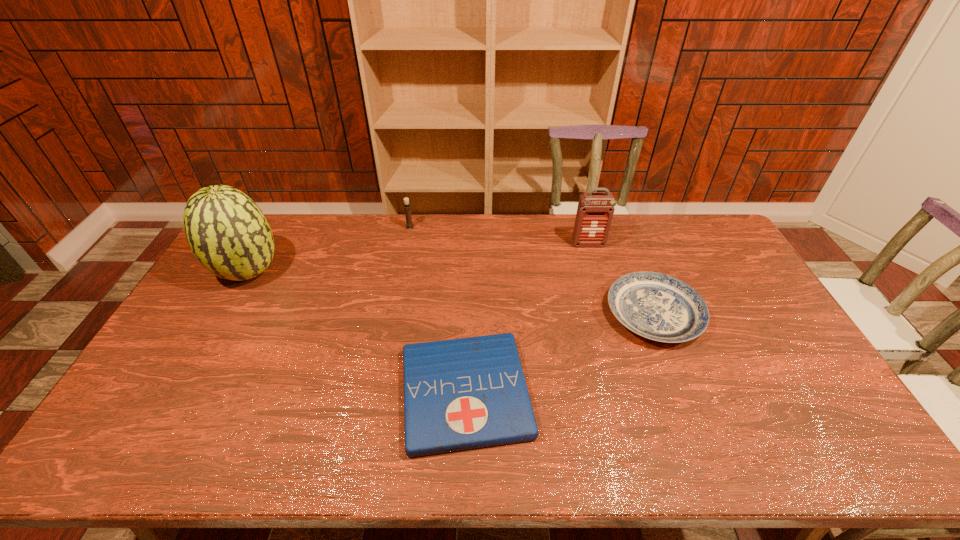
This screenshot has height=540, width=960. I want to click on the leftmost object, so click(227, 232).

Identify the location of watermelon. (227, 232).

Locate an element on the screen. The image size is (960, 540). the fourth nearest object is located at coordinates (595, 210).

This screenshot has width=960, height=540. What are the coordinates of `the farther first-aid kit` in the screenshot? It's located at (595, 210).

Find the location of `candle holder`. candle holder is located at coordinates (409, 225).

At what (x,y) coordinates should I click in order to perform the action: click on the second object from left to right. Please return your answer as a coordinate pair (x, y). This screenshot has height=540, width=960. Looking at the image, I should click on (x=409, y=225).

At what (x,y) coordinates should I click in order to perform the action: click on the fourth tallest object. Please return your answer as a coordinate pair (x, y). Looking at the image, I should click on (659, 307).

Identify the location of the nearer first-aid kit. Image resolution: width=960 pixels, height=540 pixels. (459, 394).

Locate an element on the screen. the third object from left to right is located at coordinates (459, 394).

Where is `vacant area situated 0.140m on the back of the leftmost object`? The height and width of the screenshot is (540, 960). vacant area situated 0.140m on the back of the leftmost object is located at coordinates (275, 227).